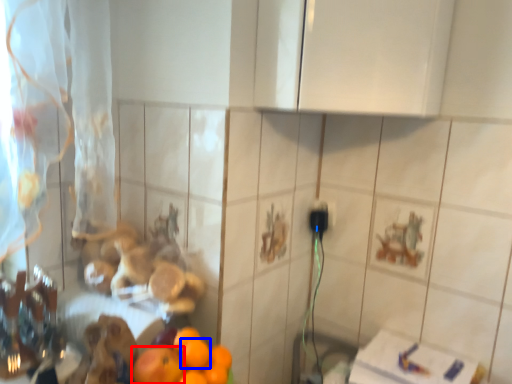
Question: Which point is closer to the camera, orange (highlighted by a red box) or orange (highlighted by a blue box)?

Choices:
 (A) orange
 (B) orange

Answer: (A)